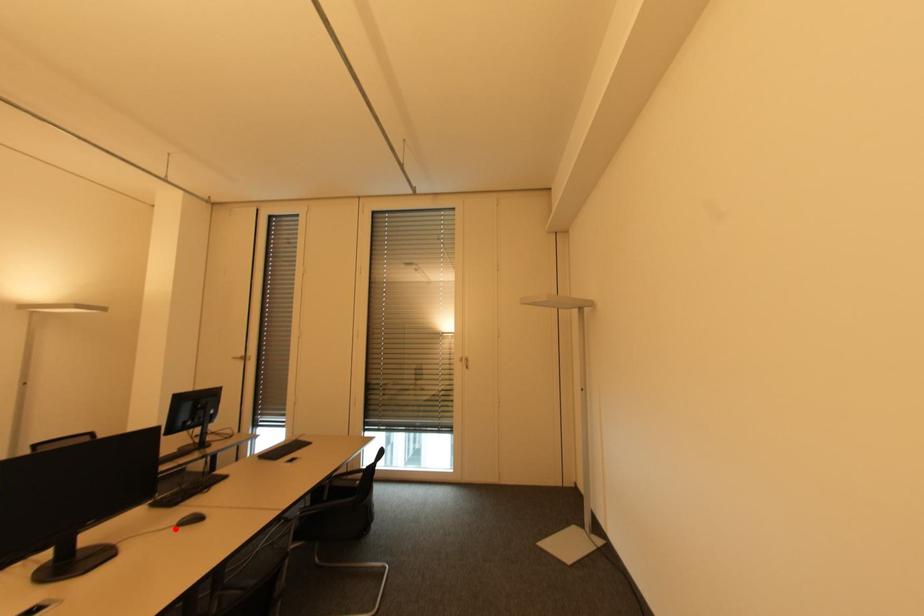
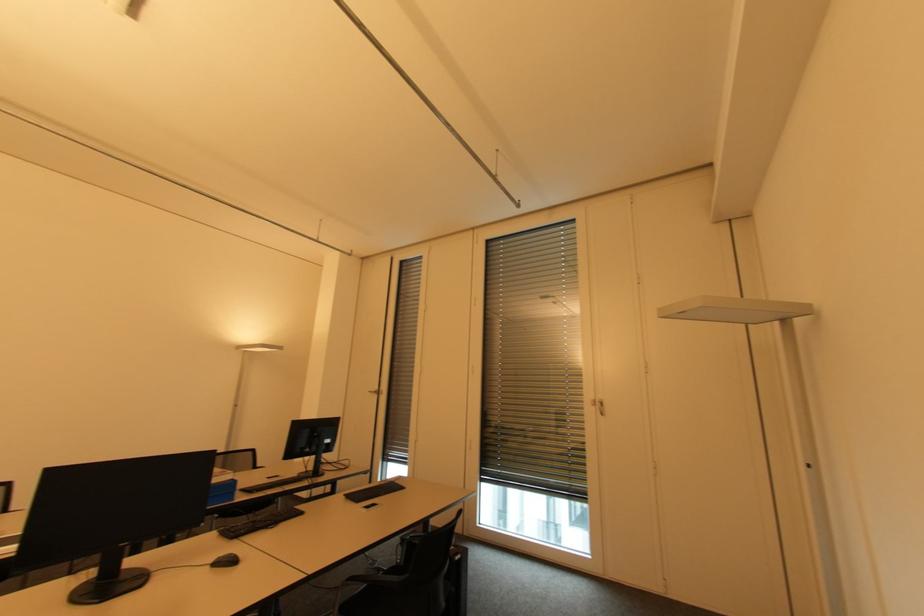
Find the pixel in the second image that matches the highlighted location in the first image.

(210, 567)